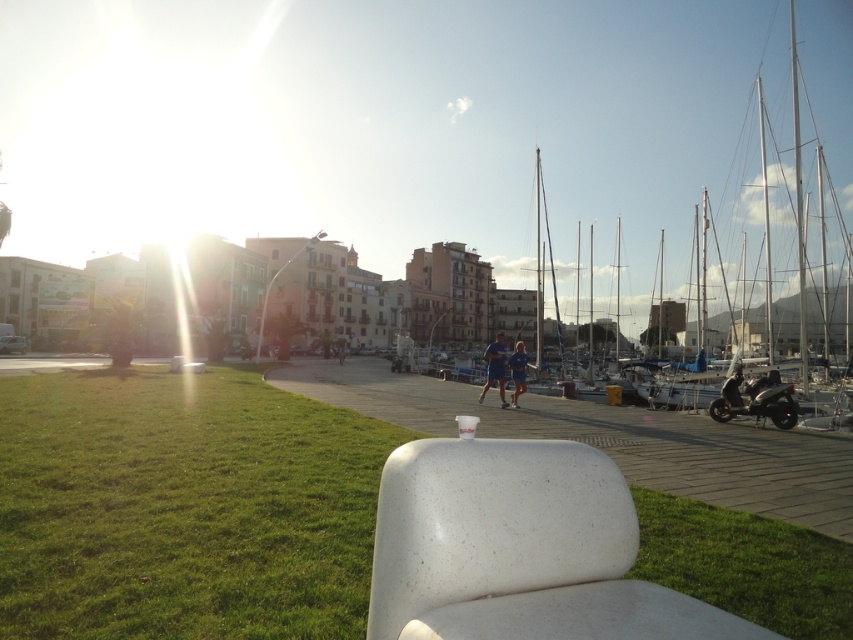
Which is in front, point (624, 541) or point (759, 384)?

Positioned in front is point (624, 541).

Between point (572, 595) and point (718, 412), which one is positioned behind?

The point (718, 412) is more distant.

Who is more forward, (572, 516) or (770, 412)?

Positioned in front is point (572, 516).

The height and width of the screenshot is (640, 853). Identify the location of white speckled plastic chair at center. (519, 548).

The height and width of the screenshot is (640, 853). What do you see at coordinates (579, 131) in the screenshot? I see `white sailboat at center` at bounding box center [579, 131].

Is white sailboat at center positioned in front of green grass at lower right?

No, it is not.

Locate an element on the screen. The image size is (853, 640). white sailboat at center is located at coordinates (579, 131).

Does white speckled plastic chair at center appear on the left side of green grass at lower right?

Indeed, white speckled plastic chair at center is positioned on the left side of green grass at lower right.

Does point (374, 600) come behind point (653, 560)?

No, (374, 600) is closer to viewer.

I want to click on white speckled plastic chair at center, so click(519, 548).